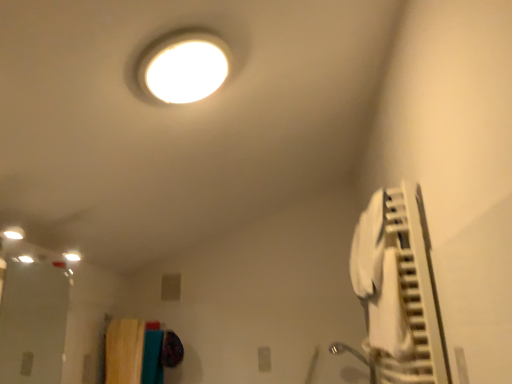
Question: Can you confirm if white fabric air conditioner at right is shorter than transparent glass door at lower left?

Choices:
 (A) no
 (B) yes

Answer: (A)

Question: Considering the relative sizes of white fabric air conditioner at right and transparent glass door at lower left in the image provided, is white fabric air conditioner at right thinner than transparent glass door at lower left?

Choices:
 (A) no
 (B) yes

Answer: (A)

Question: Can you confirm if white fabric air conditioner at right is smaller than transparent glass door at lower left?

Choices:
 (A) no
 (B) yes

Answer: (A)

Question: Is transparent glass door at lower left a part of white fabric air conditioner at right?

Choices:
 (A) yes
 (B) no

Answer: (B)

Question: Is white fabric air conditioner at right at the right side of transparent glass door at lower left?

Choices:
 (A) yes
 (B) no

Answer: (A)

Question: From the image's perspective, is white fabric air conditioner at right beneath transparent glass door at lower left?

Choices:
 (A) no
 (B) yes

Answer: (A)

Question: Is textured fabric laundry at lower left wider than transparent glass door at lower left?

Choices:
 (A) yes
 (B) no

Answer: (A)

Question: From the image's perspective, would you say textured fabric laundry at lower left is shown under transparent glass door at lower left?

Choices:
 (A) no
 (B) yes

Answer: (B)

Question: Is textured fabric laundry at lower left turned away from transparent glass door at lower left?

Choices:
 (A) no
 (B) yes

Answer: (A)

Question: From a real-world perspective, is textured fabric laundry at lower left on transparent glass door at lower left?

Choices:
 (A) no
 (B) yes

Answer: (A)

Question: Does textured fabric laundry at lower left have a lesser height compared to transparent glass door at lower left?

Choices:
 (A) no
 (B) yes

Answer: (B)

Question: Is textured fabric laundry at lower left not inside transparent glass door at lower left?

Choices:
 (A) yes
 (B) no

Answer: (A)

Question: From a real-world perspective, is transparent glass door at lower left located higher than textured fabric laundry at lower left?

Choices:
 (A) yes
 (B) no

Answer: (A)